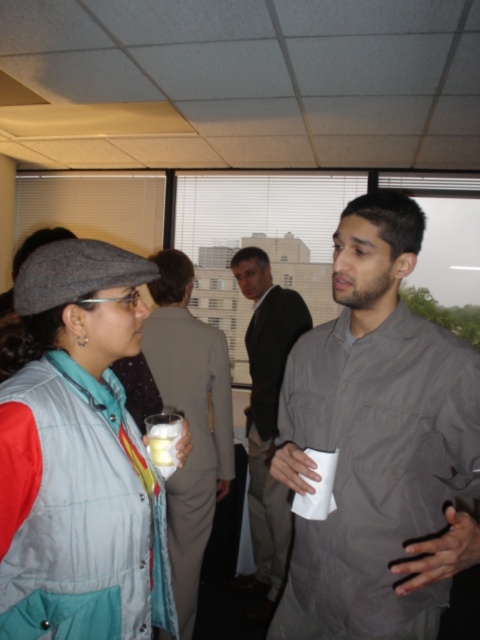
Between gray matte shirt at right and matte gray suit at center, which one has less height?

gray matte shirt at right

Locate an element on the screen. The height and width of the screenshot is (640, 480). gray matte shirt at right is located at coordinates (377, 444).

Who is lower down, gray matte shirt at right or dark gray shirt at center?

dark gray shirt at center is lower down.

Who is more forward, (299, 362) or (256, 337)?

Point (299, 362) is in front.

Image resolution: width=480 pixels, height=640 pixels. Describe the element at coordinates (377, 444) in the screenshot. I see `gray matte shirt at right` at that location.

Locate an element on the screen. This screenshot has width=480, height=640. gray matte shirt at right is located at coordinates (377, 444).

Is matte gray suit at center smaller than dark gray shirt at center?

Correct, matte gray suit at center occupies less space than dark gray shirt at center.

Does matte gray suit at center appear on the right side of dark gray shirt at center?

Incorrect, matte gray suit at center is not on the right side of dark gray shirt at center.

The width and height of the screenshot is (480, 640). What are the coordinates of `matte gray suit at center` in the screenshot? It's located at (190, 420).